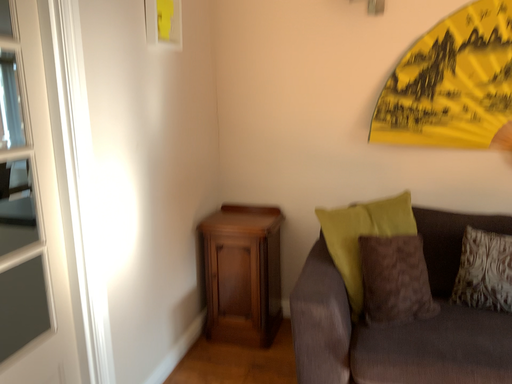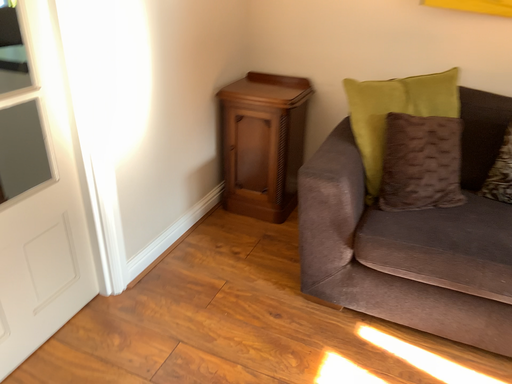
Question: Which way did the camera rotate in the video?

Choices:
 (A) rotated upward
 (B) rotated downward

Answer: (B)